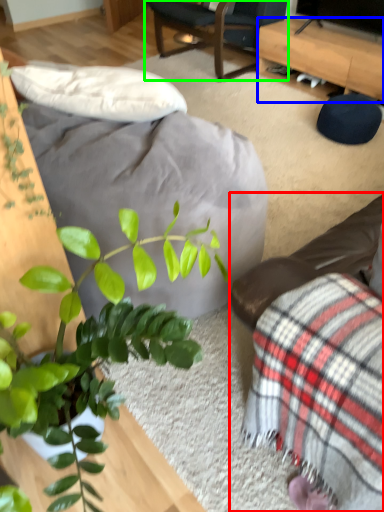
Question: Which is nearer to the studio couch (highlighted by a red box)? desk (highlighted by a blue box) or chair (highlighted by a green box).

Choices:
 (A) desk
 (B) chair

Answer: (A)